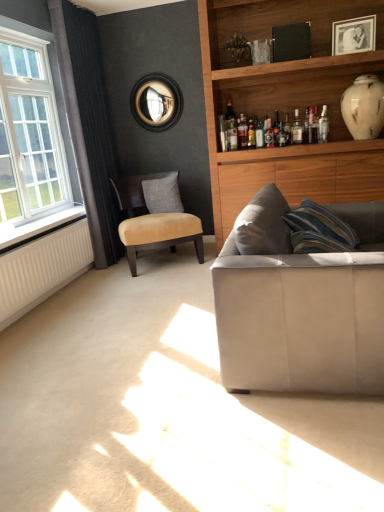
Find the location of a particular element. gray fabric pillow at center is located at coordinates (163, 194).

Describe the element at coordinates (153, 222) in the screenshot. I see `suede/leather chair at center-left` at that location.

In order to face translucent glass bottle at upper center, the 1th bottle from the right, should I rotate leftwards or rightwards?

It's best to rotate right around 10.255 degrees.

Describe the element at coordinates (37, 227) in the screenshot. I see `white plastic window sill at left` at that location.

The width and height of the screenshot is (384, 512). I want to click on gray fabric pillow at center, so click(x=163, y=194).

From the picture: Is white glossy vase at upper right facing away from white glass window at left?

No.

Can you confirm if white glossy vase at upper right is wider than white glass window at left?

Indeed, white glossy vase at upper right has a greater width compared to white glass window at left.

Consider the image. Is the surface of white glossy vase at upper right in direct contact with white glass window at left?

No, white glossy vase at upper right is not next to white glass window at left.

The width and height of the screenshot is (384, 512). I want to click on vase located on the right of white glass window at left, so click(x=364, y=106).

In order to click on the 1st bottle to the right when counting from the gray fabric pillow at center in this screenshot , I will do `click(242, 132)`.

From the image's perspective, relative to gray fabric pillow at center, is translucent glass bottle at upper center, arranged as the 2th bottle when viewed from the right, above or below?

From the image's perspective, translucent glass bottle at upper center, arranged as the 2th bottle when viewed from the right, appears above gray fabric pillow at center.

Looking at the image, does translucent glass bottle at upper center, positioned as the first bottle in left-to-right order, seem bigger or smaller compared to gray fabric pillow at center?

In the image, translucent glass bottle at upper center, positioned as the first bottle in left-to-right order, appears to be smaller than gray fabric pillow at center.

Is suede-like beige couch at lower right positioned beyond the bounds of gray fabric pillow at center?

Yes.

Can you confirm if suede-like beige couch at lower right is shorter than gray fabric pillow at center?

Incorrect, the height of suede-like beige couch at lower right does not fall short of that of gray fabric pillow at center.

Where is `pillow that appears above the suede-like beige couch at lower right (from a real-world perspective)`? The image size is (384, 512). pillow that appears above the suede-like beige couch at lower right (from a real-world perspective) is located at coordinates (163, 194).

Is white plastic window sill at left smaller than wooden photo frame at upper right?

Actually, white plastic window sill at left might be larger than wooden photo frame at upper right.

Is white plastic window sill at left inside or outside of wooden photo frame at upper right?

white plastic window sill at left is not inside wooden photo frame at upper right, it's outside.

Considering the positions of points (27, 234) and (334, 41), is point (27, 234) closer to camera compared to point (334, 41)?

Yes, it is.

Is white plastic window sill at left oriented away from wooden photo frame at upper right?

No, white plastic window sill at left is not facing away from wooden photo frame at upper right.

From the image's perspective, is wooden photo frame at upper right on top of dark grey fabric curtain at left?

Indeed, from the image's perspective, wooden photo frame at upper right is shown above dark grey fabric curtain at left.

Who is smaller, wooden photo frame at upper right or dark grey fabric curtain at left?

With smaller size is wooden photo frame at upper right.

Considering the relative positions of wooden photo frame at upper right and dark grey fabric curtain at left in the image provided, is wooden photo frame at upper right to the right of dark grey fabric curtain at left from the viewer's perspective?

Yes.

Is point (349, 27) positioned behind point (95, 148)?

No, (349, 27) is in front of (95, 148).

From a real-world perspective, is suede-like beige couch at lower right located beneath translucent glass bottle at upper center, the 1th bottle from the right?

Yes, from a real-world perspective, suede-like beige couch at lower right is under translucent glass bottle at upper center, the 1th bottle from the right.

Choose the correct answer: Is suede-like beige couch at lower right inside translucent glass bottle at upper center, the 2th bottle positioned from the left, or outside it?

suede-like beige couch at lower right is not enclosed by translucent glass bottle at upper center, the 2th bottle positioned from the left.

Is suede-like beige couch at lower right oriented towards translucent glass bottle at upper center, the 2th bottle positioned from the left?

No, suede-like beige couch at lower right is not turned towards translucent glass bottle at upper center, the 2th bottle positioned from the left.

Is suede-like beige couch at lower right far from translucent glass bottle at upper center, the 2th bottle positioned from the left?

Yes, suede-like beige couch at lower right and translucent glass bottle at upper center, the 2th bottle positioned from the left, are located far from each other.

How different are the orientations of dark grey fabric curtain at left and suede-like beige couch at lower right in degrees?

There is a 1.52-degree angle between the facing directions of dark grey fabric curtain at left and suede-like beige couch at lower right.

Do you think dark grey fabric curtain at left is within suede-like beige couch at lower right, or outside of it?

dark grey fabric curtain at left lies outside suede-like beige couch at lower right.

From the image's perspective, between dark grey fabric curtain at left and suede-like beige couch at lower right, who is located below?

From the image's view, suede-like beige couch at lower right is below.

Who is smaller, dark grey fabric curtain at left or suede-like beige couch at lower right?

With smaller size is dark grey fabric curtain at left.

Identify the location of vase on the right of white glass window at left. The width and height of the screenshot is (384, 512). (364, 106).

Starting from the gray fabric pillow at center, which bottle is the 1st one in front? Please provide its 2D coordinates.

[(242, 132)]

Considering their positions, is suede/leather chair at center-left positioned closer to gray fabric pillow at center than suede-like beige couch at lower right?

suede/leather chair at center-left is positioned closer to the anchor gray fabric pillow at center.

Consider the image. Considering their positions, is white ribbed radiator at lower left positioned closer to suede/leather chair at center-left than wooden photo frame at upper right?

white ribbed radiator at lower left lies closer to suede/leather chair at center-left than the other object.

From the image, which object appears to be nearer to suede-like beige couch at lower right, suede/leather chair at center-left or white glossy vase at upper right?

Based on the image, suede/leather chair at center-left appears to be nearer to suede-like beige couch at lower right.

Estimate the real-world distances between objects in this image. Which object is closer to suede/leather chair at center-left, wooden photo frame at upper right or suede-like beige couch at lower right?

suede-like beige couch at lower right.

Based on the photo, from the image, which object appears to be nearer to gray fabric pillow at center, translucent glass bottle at upper center, the 2th bottle positioned from the left, or white plastic window sill at left?

Among the two, white plastic window sill at left is located nearer to gray fabric pillow at center.

Looking at the image, which one is located closer to gray fabric pillow at center, white ribbed radiator at lower left or white glass window at left?

The object closer to gray fabric pillow at center is white ribbed radiator at lower left.

Estimate the real-world distances between objects in this image. Which object is closer to translucent glass bottle at upper center, positioned as the first bottle in left-to-right order, white plastic window sill at left or dark grey fabric curtain at left?

The object closer to translucent glass bottle at upper center, positioned as the first bottle in left-to-right order, is dark grey fabric curtain at left.

Based on their spatial positions, is wooden photo frame at upper right or suede-like beige couch at lower right further from white plastic window sill at left?

wooden photo frame at upper right.

Where is `curtain between white plastic window sill at left and wooden photo frame at upper right`? The height and width of the screenshot is (512, 384). curtain between white plastic window sill at left and wooden photo frame at upper right is located at coordinates (88, 124).

Locate an element on the screen. curtain between white plastic window sill at left and gray fabric pillow at center from front to back is located at coordinates (88, 124).

At what (x,y) coordinates should I click in order to perform the action: click on curtain between white plastic window sill at left and translucent glass bottle at upper center, the 1th bottle from the right. Please return your answer as a coordinate pair (x, y). The width and height of the screenshot is (384, 512). Looking at the image, I should click on (88, 124).

This screenshot has height=512, width=384. Identify the location of curtain positioned between white glass window at left and suede/leather chair at center-left from near to far. (88, 124).